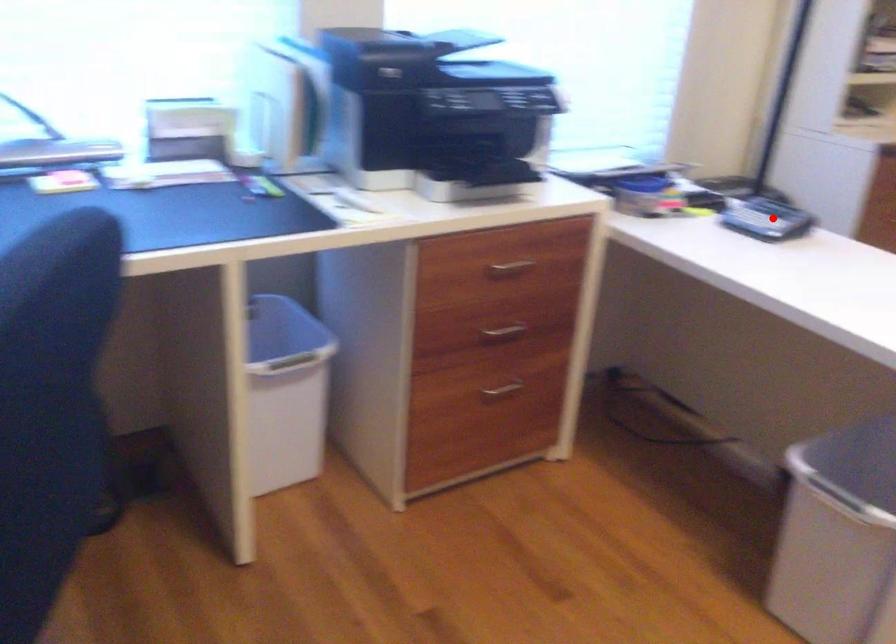
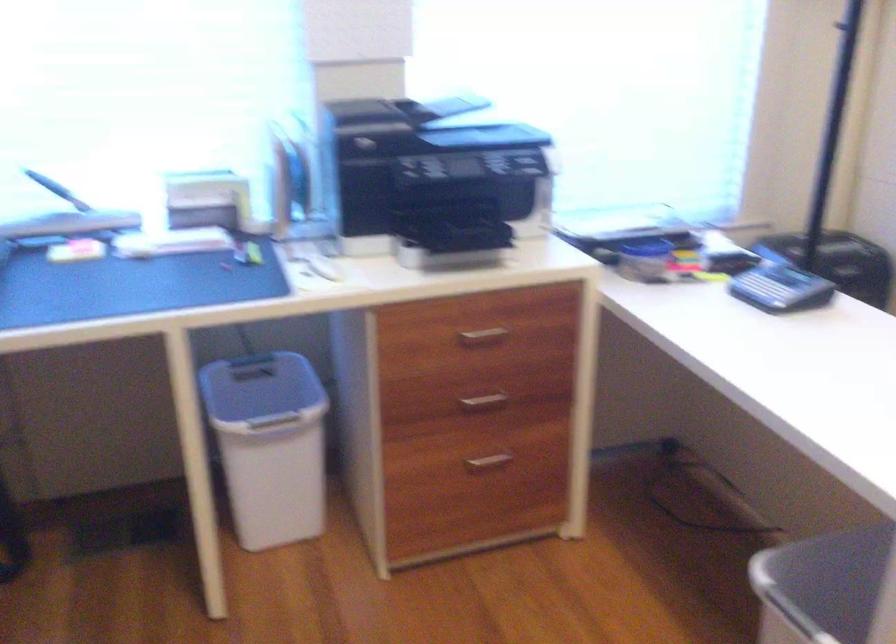
Question: I am providing you with two images of the same scene from different viewpoints. Image1 has a red point marked. In image2, the corresponding 3D location appears at what relative position? Reply with the corresponding letter.

Choices:
 (A) Closer
 (B) Farther

Answer: (A)